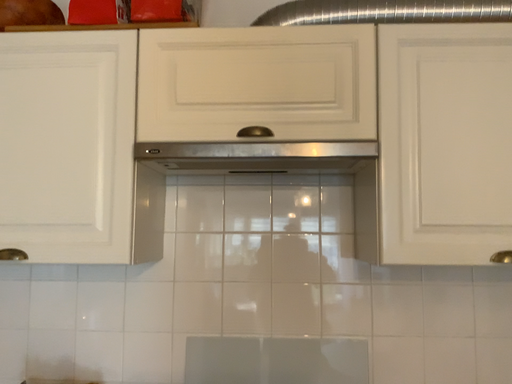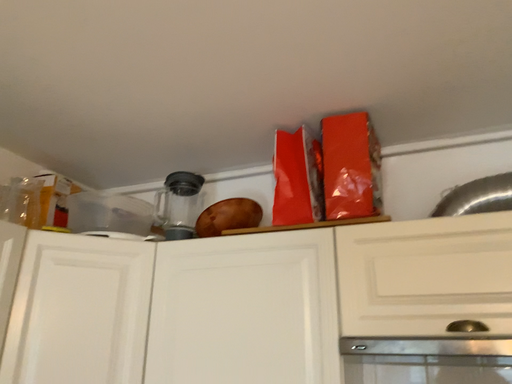
Question: Which way did the camera rotate in the video?

Choices:
 (A) rotated downward
 (B) rotated upward

Answer: (B)